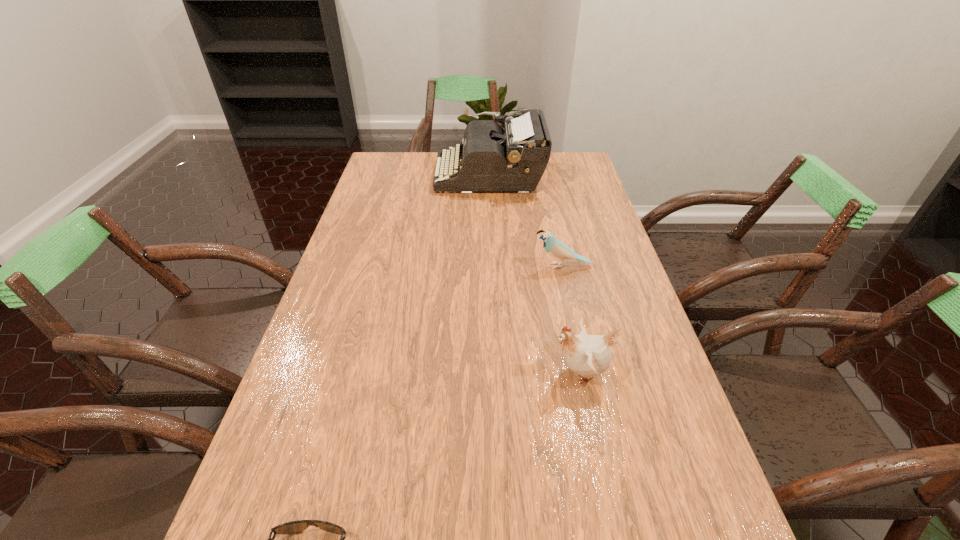
Locate an element on the screen. The width and height of the screenshot is (960, 540). blank space located 0.240m at the beak of the nearer bird is located at coordinates (442, 373).

Locate an element on the screen. Image resolution: width=960 pixels, height=540 pixels. vacant space situated at the beak of the nearer bird is located at coordinates (483, 373).

What are the coordinates of `free space located 0.330m at the face of the second farthest object` in the screenshot? It's located at [416, 266].

Find the location of a particular element. This screenshot has width=960, height=540. free location located 0.180m at the face of the second farthest object is located at coordinates (469, 266).

This screenshot has width=960, height=540. I want to click on free space located at the face of the second farthest object, so click(459, 266).

Find the location of a particular element. The height and width of the screenshot is (540, 960). object located in the far edge section of the desktop is located at coordinates (493, 159).

You are a GUI agent. You are given a task and a screenshot of the screen. Output one action in this format:
    pyautogui.click(x=<x>, y=<y>)
    Task: Click on the free space at the left edge
    This screenshot has width=960, height=540.
    Given the screenshot: What is the action you would take?
    pyautogui.click(x=373, y=280)

This screenshot has height=540, width=960. Identify the location of vacant space at the right edge of the desktop. (592, 187).

Image resolution: width=960 pixels, height=540 pixels. Find the location of `blank space at the far left corner of the desktop`. blank space at the far left corner of the desktop is located at coordinates (396, 171).

Where is `blank space at the far right corner of the desktop`? blank space at the far right corner of the desktop is located at coordinates (559, 173).